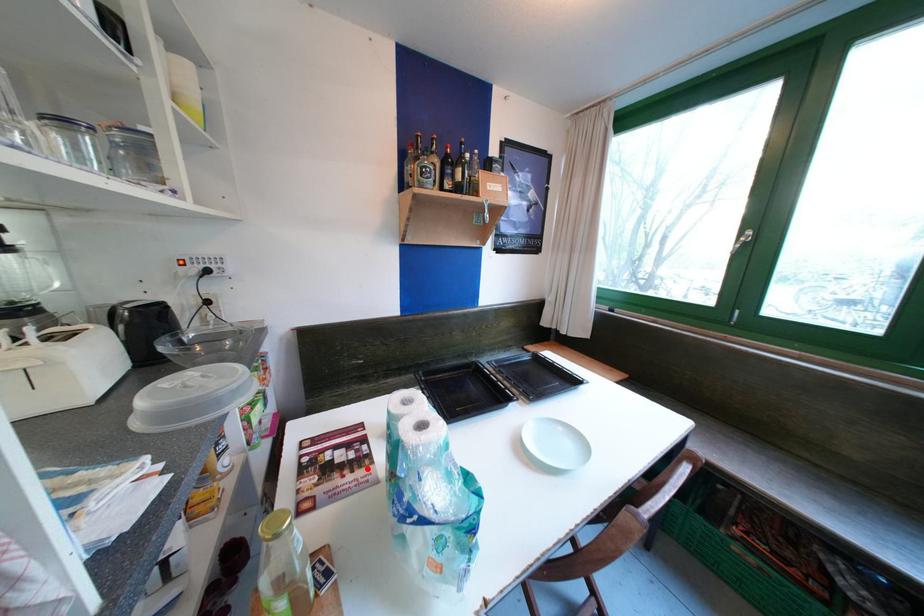
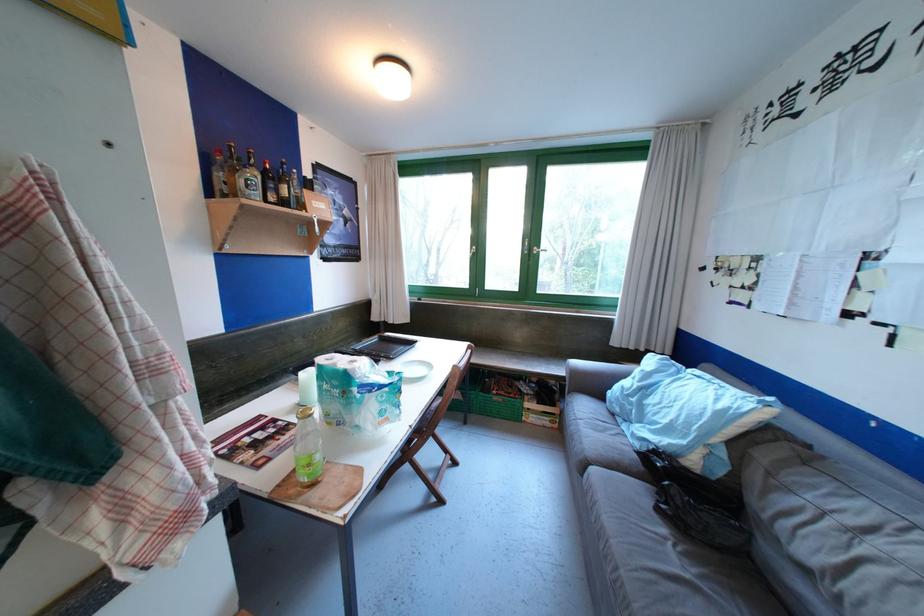
The point at the highlighted location is marked in the first image. Where is the corresponding point in the second image?

(296, 432)